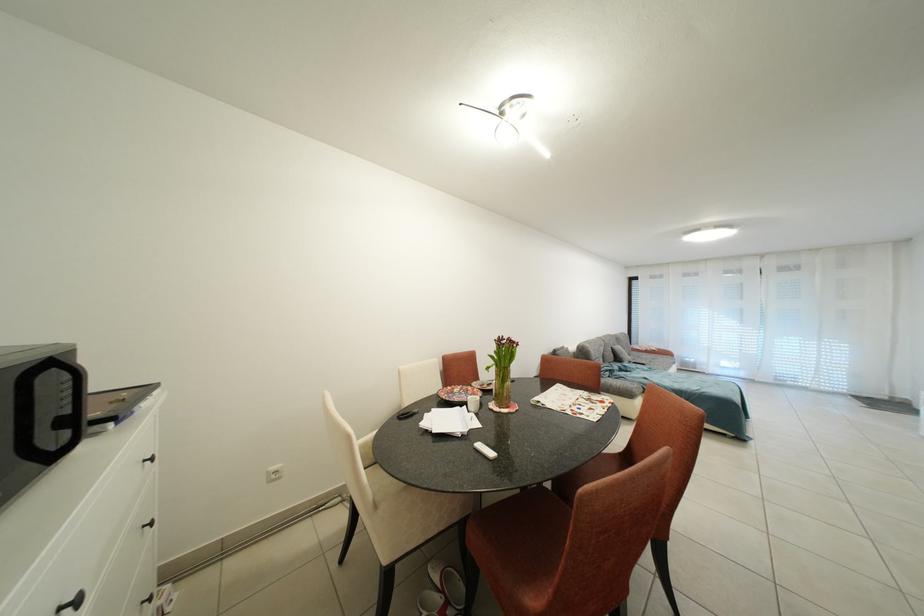
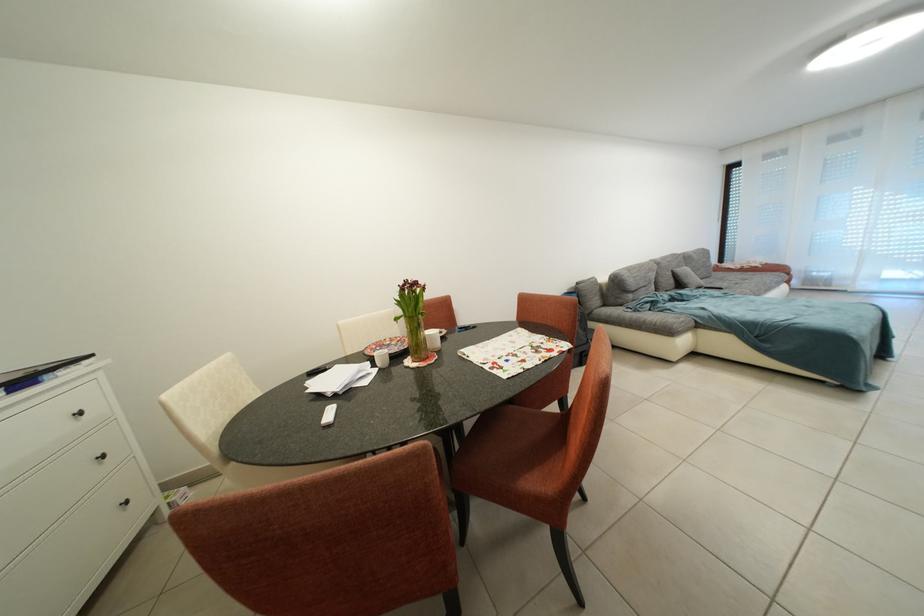
Question: Based on the continuous images, in which direction is the camera rotating? Reply with the corresponding letter.

Choices:
 (A) Left
 (B) Right
 (C) Up
 (D) Down

Answer: (A)